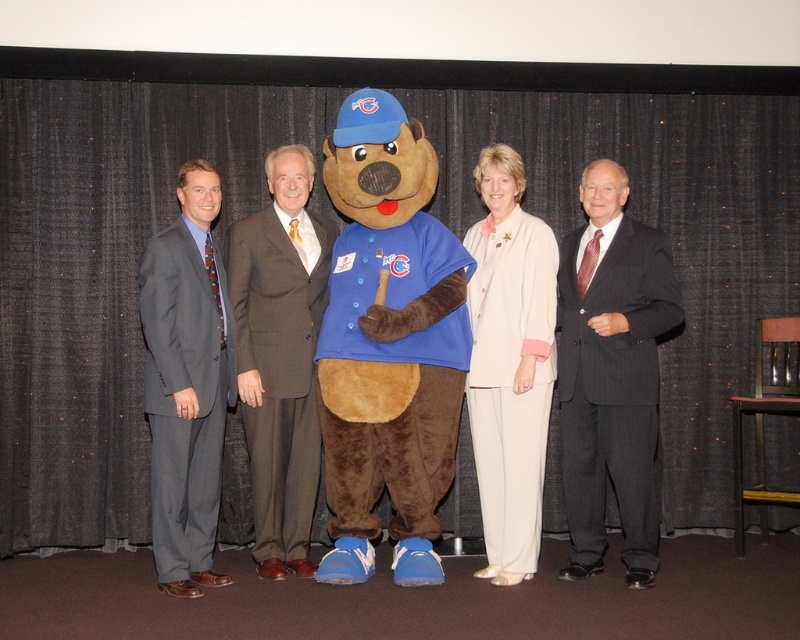
In the photo, there are two people wearing suits. One is in a dark gray pinstripe suit at right and the other in a gray suit at left. From the perspective of someone standing in front of the photo, which suit is positioned to the right of the other?

The dark gray pinstripe suit at right is positioned to the right of the gray suit at left.

You are a photographer setting up for a group photo. You have two suits available for the central figure in the scene described. The brown wool suit at center and the light beige fabric suit at center. Which suit would you choose if you want the central figure to appear wider in the photo?

The brown wool suit at center is wider than the light beige fabric suit at center, so choosing the brown wool suit at center would make the central figure appear wider in the photo.